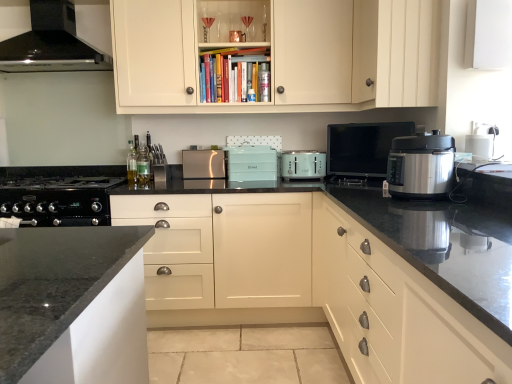
Question: Is clear glass bottle at center, arranged as the first bottle when viewed from the left, wider or thinner than satin silver toaster at center, positioned as the 5th kitchen appliance in front-to-back order?

Choices:
 (A) thin
 (B) wide

Answer: (A)

Question: Is clear glass bottle at center, arranged as the first bottle when viewed from the left, to the left or to the right of satin silver toaster at center, the 1th kitchen appliance in the left-to-right sequence, in the image?

Choices:
 (A) left
 (B) right

Answer: (A)

Question: Which of these objects is positioned closest to the white plastic toaster at center, the 3th kitchen appliance in the back-to-front sequence?

Choices:
 (A) matte white drawers at right, positioned as the 4th cabinetry in top-to-bottom order
 (B) white matte cabinet at upper right, the 2th cabinetry viewed from the top
 (C) white matte cabinet at upper right, which is the 3th cabinetry from top to bottom
 (D) translucent glass bottle at center, positioned as the second bottle in left-to-right order
 (E) matte white cabinet at center, marked as the first cabinetry in a bottom-to-top arrangement

Answer: (E)

Question: Which object is the closest to the clear glass bottle at center, arranged as the first bottle when viewed from the left?

Choices:
 (A) satin silver pressure cooker at right, marked as the 1th kitchen appliance in a right-to-left arrangement
 (B) matte white cabinet at upper center, which is the 1th cabinetry in top-to-bottom order
 (C) black glossy range hood at upper left, positioned as the first home appliance in top-to-bottom order
 (D) white plastic toaster at center, the third kitchen appliance from the front
 (E) translucent glass bottle at center, which appears as the 1th bottle when viewed from the right

Answer: (E)